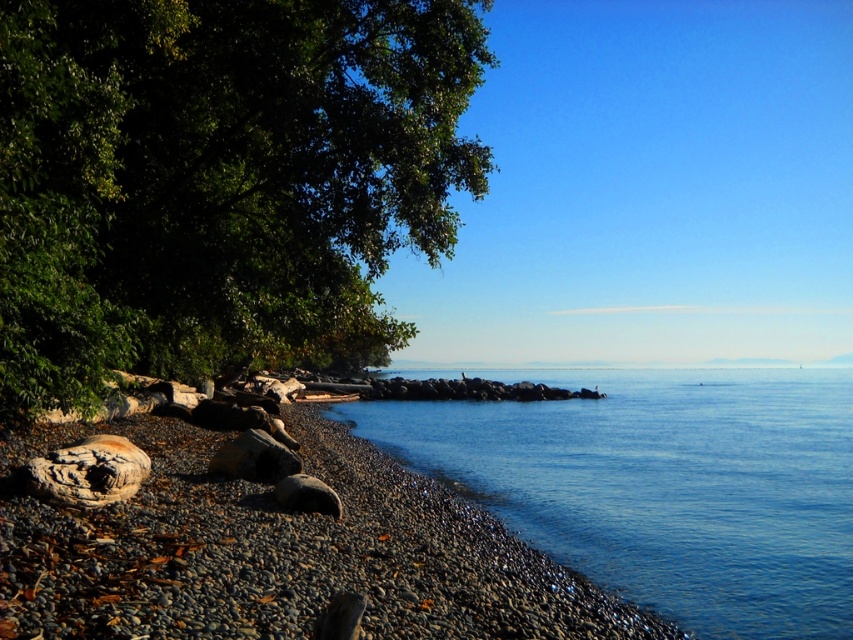
Question: Which of these objects is positioned closest to the smooth pebbles at lower left?

Choices:
 (A) smooth gray rock at center
 (B) blue smooth water at center
 (C) rusty textured log at lower left
 (D) green leafy tree at left

Answer: (C)

Question: Does smooth pebbles at lower left have a greater width compared to smooth gray rock at center?

Choices:
 (A) no
 (B) yes

Answer: (B)

Question: Among these points, which one is farthest from the camera?

Choices:
 (A) (299, 474)
 (B) (84, 118)
 (C) (753, 493)
 (D) (36, 504)

Answer: (C)

Question: Does green leafy tree at left have a smaller size compared to rusty textured log at lower left?

Choices:
 (A) yes
 (B) no

Answer: (B)

Question: Can you confirm if smooth pebbles at lower left is thinner than smooth gray rock at center?

Choices:
 (A) no
 (B) yes

Answer: (A)

Question: Which point is closer to the camera taking this photo?

Choices:
 (A) (780, 417)
 (B) (3, 605)
 (C) (288, 492)
 (D) (213, 236)

Answer: (B)